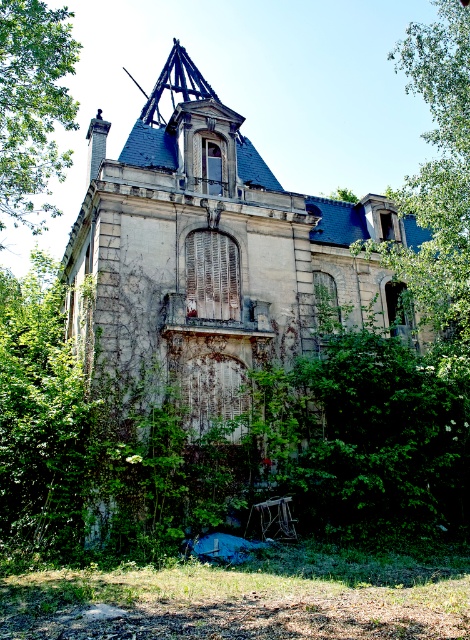
Please provide the 2D coordinates of the weathered stone mansion at center in the image.

The weathered stone mansion at center is located at the 2D coordinates of point (214,253).

You are a drone operator tasked with capturing aerial footage of the abandoned mansion. Your drone has a maximum flight range of 120 feet from its starting point. If you position the drone at the center of the mansion, will it be able to fly between the green leafy tree at upper right and the green leafy tree at upper left without exceeding its range?

The distance between the green leafy tree at upper right and the green leafy tree at upper left is 130.84 feet. Since the drone has a maximum range of 120 feet from its starting point at the mansion center, it cannot safely traverse the entire distance between the two trees without exceeding its operational range.